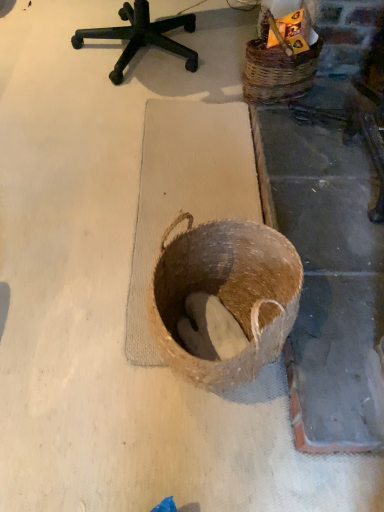
This screenshot has width=384, height=512. What do you see at coordinates (226, 294) in the screenshot?
I see `brown woven basket at center, the 2th basket from the back` at bounding box center [226, 294].

Image resolution: width=384 pixels, height=512 pixels. What do you see at coordinates (277, 72) in the screenshot?
I see `woven brown basket at upper right, positioned as the 1th basket in top-to-bottom order` at bounding box center [277, 72].

What is the approximate height of wooden crate at upper right?

It is 6.02 inches.

Find the location of a particular element. This screenshot has width=384, height=512. brown woven basket at center, positioned as the first basket in left-to-right order is located at coordinates (226, 294).

Based on the photo, which is more to the left, wooden crate at upper right or brown woven basket at center, the 2th basket in the top-to-bottom sequence?

brown woven basket at center, the 2th basket in the top-to-bottom sequence, is more to the left.

Is wooden crate at upper right oriented away from brown woven basket at center, which is counted as the second basket, starting from the right?

No, wooden crate at upper right is not facing the opposite direction of brown woven basket at center, which is counted as the second basket, starting from the right.

Is wooden crate at upper right smaller than brown woven basket at center, the 1th basket in the front-to-back sequence?

Yes.

Is the surface of wooden crate at upper right in direct contact with woven brown basket at upper right, positioned as the 1th basket in top-to-bottom order?

wooden crate at upper right and woven brown basket at upper right, positioned as the 1th basket in top-to-bottom order, are clearly separated.

Looking at this image, from the image's perspective, between wooden crate at upper right and woven brown basket at upper right, which ranks as the first basket in right-to-left order, which one is located above?

From the image's view, wooden crate at upper right is above.

Is wooden crate at upper right bigger or smaller than woven brown basket at upper right, positioned as the 1th basket in top-to-bottom order?

In the image, wooden crate at upper right appears to be smaller than woven brown basket at upper right, positioned as the 1th basket in top-to-bottom order.

Considering the sizes of objects brown woven basket at center, which is counted as the second basket, starting from the right, and wooden crate at upper right in the image provided, who is shorter, brown woven basket at center, which is counted as the second basket, starting from the right, or wooden crate at upper right?

Standing shorter between the two is wooden crate at upper right.

Based on their sizes in the image, would you say brown woven basket at center, which ranks as the 1th basket in bottom-to-top order, is bigger or smaller than wooden crate at upper right?

brown woven basket at center, which ranks as the 1th basket in bottom-to-top order, is bigger than wooden crate at upper right.

Looking at their sizes, would you say brown woven basket at center, positioned as the first basket in left-to-right order, is wider or thinner than wooden crate at upper right?

Clearly, brown woven basket at center, positioned as the first basket in left-to-right order, has more width compared to wooden crate at upper right.

Find the location of a particular element. Image resolution: width=384 pixels, height=512 pixels. basket positioned vertically above the brown woven basket at center, positioned as the first basket in left-to-right order (from a real-world perspective) is located at coordinates point(277,72).

Is brown woven basket at center, the 1th basket in the front-to-back sequence, oriented away from woven brown basket at upper right, which ranks as the second basket in left-to-right order?

No.

How different are the orientations of brown woven basket at center, which ranks as the 1th basket in bottom-to-top order, and woven brown basket at upper right, which ranks as the first basket in back-to-front order, in degrees?

The angular difference between brown woven basket at center, which ranks as the 1th basket in bottom-to-top order, and woven brown basket at upper right, which ranks as the first basket in back-to-front order, is 0.969 degrees.

Looking at this image, between brown woven basket at center, the 2th basket in the top-to-bottom sequence, and woven brown basket at upper right, which is the second basket from front to back, which one is positioned in front?

Positioned in front is brown woven basket at center, the 2th basket in the top-to-bottom sequence.

From a real-world perspective, is woven brown basket at upper right, which ranks as the first basket in back-to-front order, physically above brown woven basket at center, the 2th basket from the back?

Yes, from a real-world perspective, woven brown basket at upper right, which ranks as the first basket in back-to-front order, is on top of brown woven basket at center, the 2th basket from the back.

Considering the sizes of objects woven brown basket at upper right, which ranks as the second basket in left-to-right order, and brown woven basket at center, the 2th basket from the back, in the image provided, who is bigger, woven brown basket at upper right, which ranks as the second basket in left-to-right order, or brown woven basket at center, the 2th basket from the back,?

brown woven basket at center, the 2th basket from the back, is bigger.

Is woven brown basket at upper right, the second basket when ordered from bottom to top, next to brown woven basket at center, the 2th basket from the back?

No, woven brown basket at upper right, the second basket when ordered from bottom to top, is not in contact with brown woven basket at center, the 2th basket from the back.

From the image's perspective, relative to brown woven basket at center, positioned as the first basket in left-to-right order, is woven brown basket at upper right, positioned as the 1th basket in top-to-bottom order, above or below?

From the image's perspective, woven brown basket at upper right, positioned as the 1th basket in top-to-bottom order, appears above brown woven basket at center, positioned as the first basket in left-to-right order.

Does woven brown basket at upper right, which ranks as the first basket in back-to-front order, turn towards wooden crate at upper right?

No, woven brown basket at upper right, which ranks as the first basket in back-to-front order, is not oriented towards wooden crate at upper right.

How different are the orientations of woven brown basket at upper right, which ranks as the first basket in right-to-left order, and wooden crate at upper right in degrees?

There is a 13.2-degree angle between the facing directions of woven brown basket at upper right, which ranks as the first basket in right-to-left order, and wooden crate at upper right.

Between woven brown basket at upper right, positioned as the 1th basket in top-to-bottom order, and wooden crate at upper right, which one has larger width?

woven brown basket at upper right, positioned as the 1th basket in top-to-bottom order.

At what (x,y) coordinates should I click in order to perform the action: click on scrap that appears on the right of brown woven basket at center, the 2th basket in the top-to-bottom sequence. Please return your answer as a coordinate pair (x, y). Image resolution: width=384 pixels, height=512 pixels. Looking at the image, I should click on (279, 34).

Locate an element on the screen. Image resolution: width=384 pixels, height=512 pixels. scrap that appears above the woven brown basket at upper right, positioned as the 1th basket in top-to-bottom order (from the image's perspective) is located at coordinates (279, 34).

When comparing their distances from woven brown basket at upper right, which ranks as the first basket in back-to-front order, does wooden crate at upper right or brown woven basket at center, the 2th basket in the top-to-bottom sequence, seem further?

brown woven basket at center, the 2th basket in the top-to-bottom sequence, lies further to woven brown basket at upper right, which ranks as the first basket in back-to-front order, than the other object.

When comparing their distances from wooden crate at upper right, does brown woven basket at center, the 2th basket in the top-to-bottom sequence, or woven brown basket at upper right, the second basket when ordered from bottom to top, seem closer?

woven brown basket at upper right, the second basket when ordered from bottom to top, is closer to wooden crate at upper right.

Looking at the image, which one is located further to wooden crate at upper right, woven brown basket at upper right, the second basket when ordered from bottom to top, or brown woven basket at center, the 1th basket in the front-to-back sequence?

Based on the image, brown woven basket at center, the 1th basket in the front-to-back sequence, appears to be further to wooden crate at upper right.

Based on their spatial positions, is woven brown basket at upper right, which ranks as the first basket in back-to-front order, or wooden crate at upper right further from brown woven basket at center, which is counted as the second basket, starting from the right?

wooden crate at upper right is positioned further to the anchor brown woven basket at center, which is counted as the second basket, starting from the right.

Considering their positions, is wooden crate at upper right positioned closer to brown woven basket at center, which is counted as the second basket, starting from the right, than woven brown basket at upper right, which ranks as the second basket in left-to-right order?

woven brown basket at upper right, which ranks as the second basket in left-to-right order, lies closer to brown woven basket at center, which is counted as the second basket, starting from the right, than the other object.

Considering their positions, is brown woven basket at center, the 2th basket from the back, positioned further to woven brown basket at upper right, which ranks as the first basket in back-to-front order, than wooden crate at upper right?

brown woven basket at center, the 2th basket from the back, lies further to woven brown basket at upper right, which ranks as the first basket in back-to-front order, than the other object.

Identify the location of basket between wooden crate at upper right and brown woven basket at center, positioned as the first basket in left-to-right order, vertically. (277, 72).